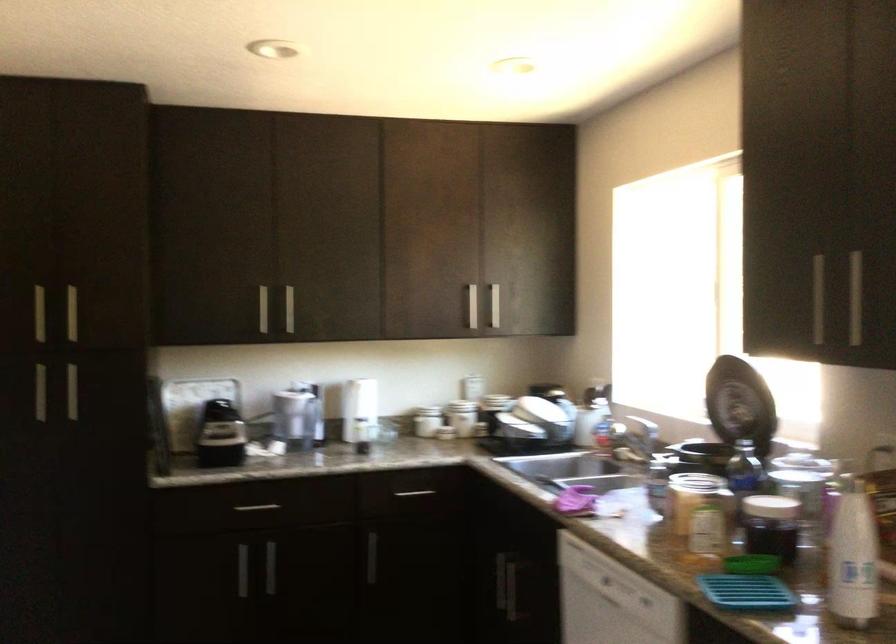
Find the location of a particular element. The image size is (896, 644). faucet handle is located at coordinates (644, 427).